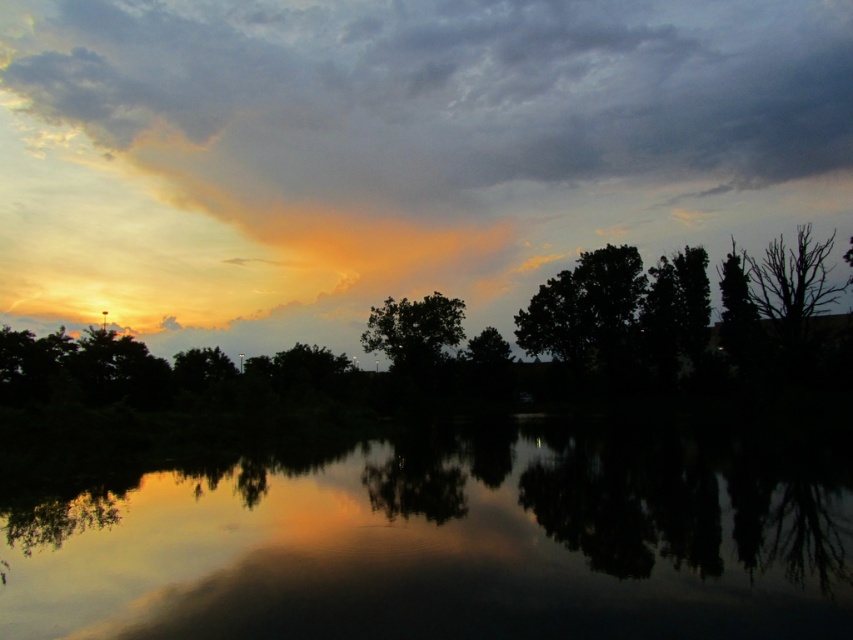
You are a photographer trying to capture the sunset reflection on the water. You have a camera with a standard lens that can focus on objects up to 10 meters away. The green leafy tree at center is blocking your view of the water. Can you still take a clear photo of the reflective dark water at center without moving the tree?

The reflective dark water at center is not as tall as the green leafy tree at center, meaning the water is shorter in height. Since the tree is blocking the view, but the water is closer to you than the tree, you can still focus on the reflective dark water at center as long as it is within the 10 meters focus range of your camera lens.